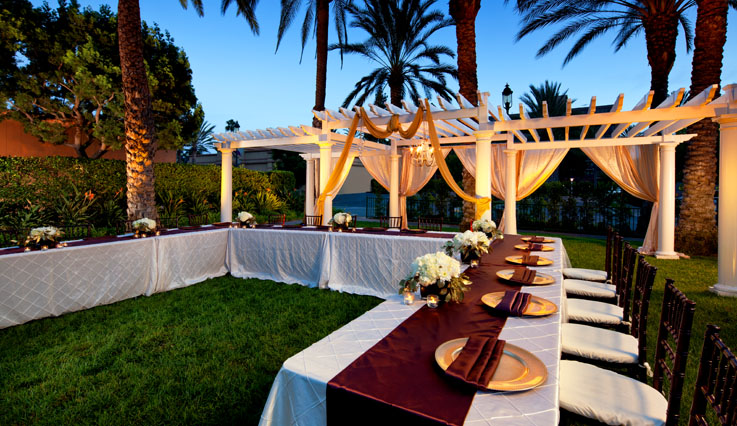
This screenshot has width=737, height=426. In order to click on napkins in this screenshot , I will do `click(472, 373)`, `click(519, 299)`, `click(522, 273)`, `click(523, 262)`, `click(534, 245)`, `click(539, 237)`.